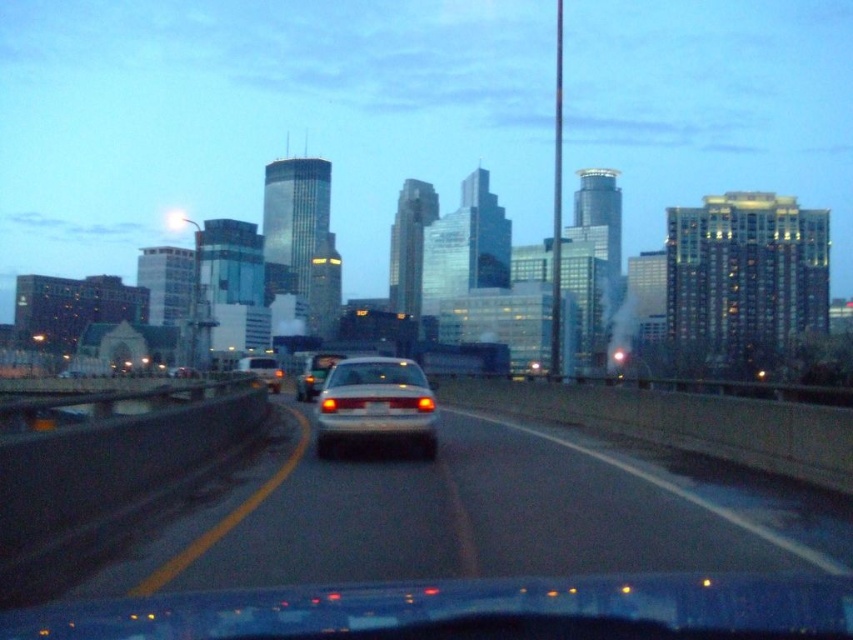
Which is more to the right, white glossy car at center or white glossy sedan at center?

white glossy car at center

What are the coordinates of `white glossy car at center` in the screenshot? It's located at (445, 516).

The height and width of the screenshot is (640, 853). Identify the location of white glossy car at center. tap(445, 516).

Which is more to the left, satin white sedan at center or matte white van at center?

Positioned to the left is matte white van at center.

Based on the photo, can you confirm if satin white sedan at center is positioned to the left of matte white van at center?

Incorrect, satin white sedan at center is not on the left side of matte white van at center.

The image size is (853, 640). What do you see at coordinates (375, 404) in the screenshot? I see `satin white sedan at center` at bounding box center [375, 404].

Where is `satin white sedan at center`? satin white sedan at center is located at coordinates (375, 404).

Between white glossy car at center and satin white sedan at center, which one is positioned higher?

satin white sedan at center is higher up.

Between white glossy car at center and satin white sedan at center, which one appears on the right side from the viewer's perspective?

white glossy car at center

Where is `white glossy car at center`? The image size is (853, 640). white glossy car at center is located at coordinates (445, 516).